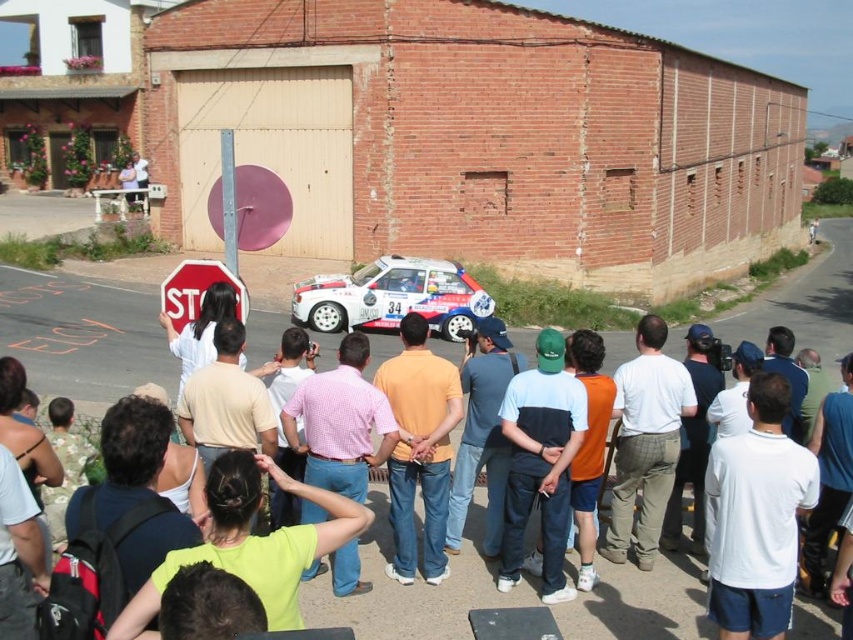
Question: Which point is closer to the camera?

Choices:
 (A) white cotton shirt at center
 (B) light blue cotton shirt at center

Answer: (A)

Question: Does orange cotton shirt at center appear on the left side of white glossy rally car at center?

Choices:
 (A) no
 (B) yes

Answer: (A)

Question: Which point appears closest to the camera in this image?

Choices:
 (A) (410, 392)
 (B) (335, 586)
 (C) (590, 612)

Answer: (C)

Question: Is pink checkered shirt at center thinner than white glossy rally car at center?

Choices:
 (A) no
 (B) yes

Answer: (B)

Question: Which point is closer to the camera taking this photo?

Choices:
 (A) (549, 330)
 (B) (340, 458)
 (C) (409, 554)
 (D) (91, 353)

Answer: (B)

Question: Can you confirm if white glossy rally car at center is thinner than red matte stop sign at center?

Choices:
 (A) no
 (B) yes

Answer: (A)